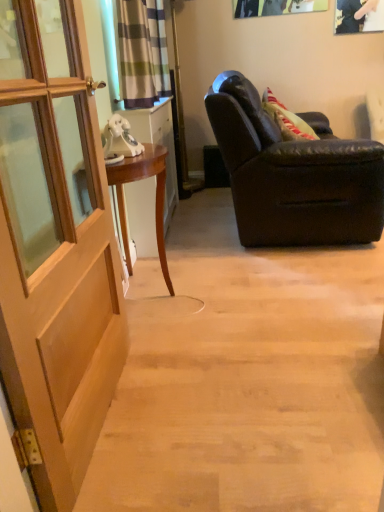
Locate an element on the screen. free location to the right of mahogany wood desk at left is located at coordinates (225, 292).